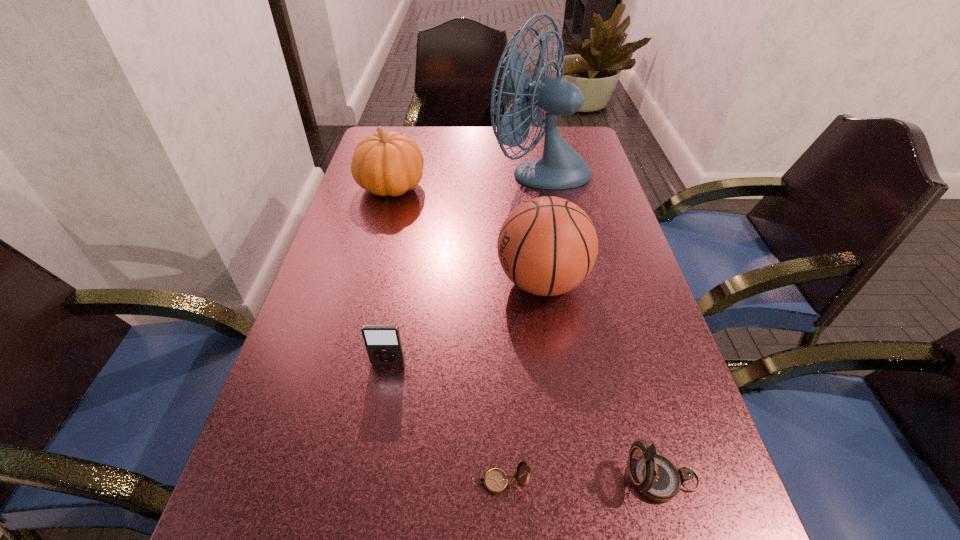
Where is `vacant space in between the pumpkin and the shorter compass`? vacant space in between the pumpkin and the shorter compass is located at coordinates (446, 335).

Locate which object ranks fourth in proximity to the shorter compass. Please provide its 2D coordinates. Your answer should be formatted as a tuple, i.e. [(x, y)], where the tuple contains the x and y coordinates of a point satisfying the conditions above.

[(390, 163)]

Identify the location of object that is the closest to the right compass. (496, 481).

The height and width of the screenshot is (540, 960). Identify the location of vacant position in the image that satisfies the following two spatial constraints: 1. on the surface of the third farthest object near the brand logo; 2. on the front-facing side of the third nearest object. (554, 363).

At what (x,y) coordinates should I click in order to perform the action: click on free location that satisfies the following two spatial constraints: 1. on the surface of the third farthest object near the brand logo; 2. on the front-facing side of the iPod. Please return your answer as a coordinate pair (x, y). This screenshot has width=960, height=540. Looking at the image, I should click on (554, 363).